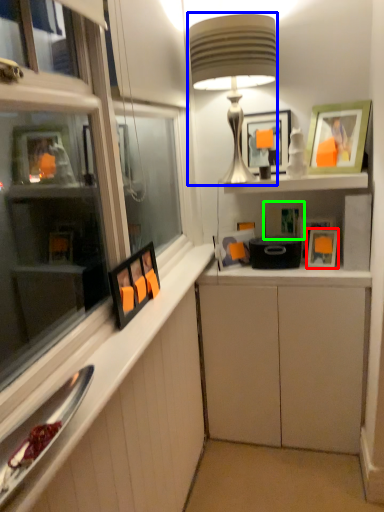
Question: Based on their relative distances, which object is nearer to picture frame (highlighted by a red box)? Choose from table lamp (highlighted by a blue box) and picture frame (highlighted by a green box).

Choices:
 (A) table lamp
 (B) picture frame

Answer: (B)